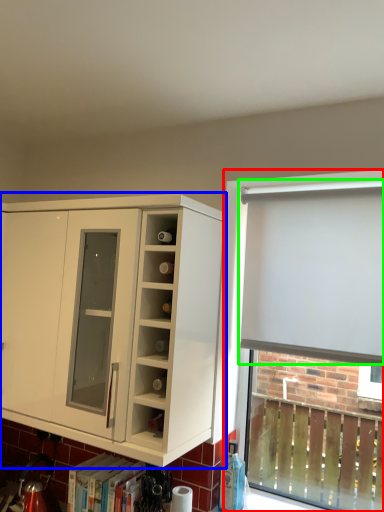
Question: Considering the real-world distances, which object is closest to bay window (highlighted by a red box)? cabinetry (highlighted by a blue box) or curtain (highlighted by a green box).

Choices:
 (A) cabinetry
 (B) curtain

Answer: (B)